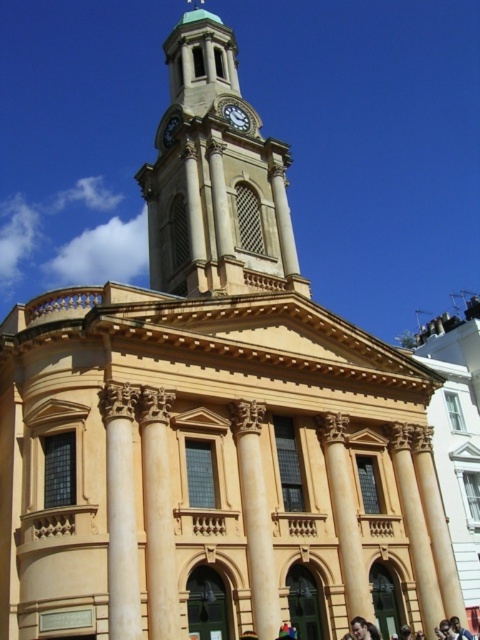
Is beige stone column at center below smooth skin face at center?

No.

What do you see at coordinates (255, 516) in the screenshot?
I see `beige stone column at center` at bounding box center [255, 516].

Is point (259, 467) closer to viewer compared to point (361, 636)?

That is False.

Identify the location of beige stone column at center. The height and width of the screenshot is (640, 480). (255, 516).

Is beige stone column at center smaller than gold metallic clock at upper center?

No, beige stone column at center is not smaller than gold metallic clock at upper center.

Can you confirm if beige stone column at center is wider than gold metallic clock at upper center?

Yes, beige stone column at center is wider than gold metallic clock at upper center.

What are the coordinates of `beige stone column at center` in the screenshot? It's located at (255, 516).

You are a GUI agent. You are given a task and a screenshot of the screen. Output one action in this format:
    pyautogui.click(x=<x>, y=<y>)
    Task: Click on the beige stone column at center
    The image size is (480, 640).
    Given the screenshot: What is the action you would take?
    tap(255, 516)

Is smooth skin face at center bigger than multicolored striped shirt at lower center?

Correct, smooth skin face at center is larger in size than multicolored striped shirt at lower center.

Measure the distance between smooth skin face at center and camera.

They are 31.33 meters apart.

This screenshot has width=480, height=640. What do you see at coordinates (361, 628) in the screenshot? I see `smooth skin face at center` at bounding box center [361, 628].

Locate an element on the screen. The width and height of the screenshot is (480, 640). smooth skin face at center is located at coordinates click(361, 628).